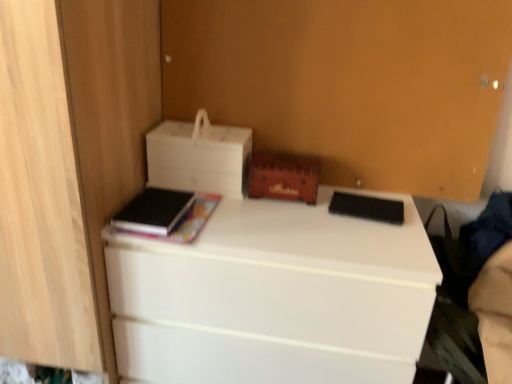
I want to click on free space above white matte desk at center (from a real-world perspective), so click(x=295, y=215).